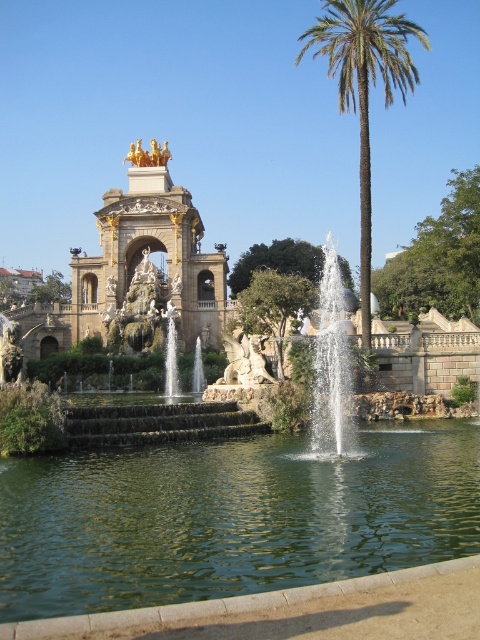
You are standing at the center of the park and see two points marked in the image. Which point, point [118,564] or point [320,45], is closer to you?

Point [118,564] is closer to the camera than point [320,45], so it is closer to you.

You are a visitor at the park and want to take a photo of both the green liquid water at center and the green leafy palm tree at right. Since you want both to be fully visible in the photo, which object should you position closer to the camera to ensure they both fit in the frame?

You should position the green leafy palm tree at right closer to the camera because the green liquid water at center is wider than the green leafy palm tree at right, so bringing the palm tree nearer will help balance their sizes in the photo.

You are planning to take a photo of the green leafy palm tree at right and the clear glass fountain at center in the park. Which object should you focus on first if you want to capture both in a single frame without moving the camera?

The green leafy palm tree at right is bigger than the clear glass fountain at center, so you should focus on the green leafy palm tree at right first to ensure it is in clear view before adjusting for the smaller fountain.